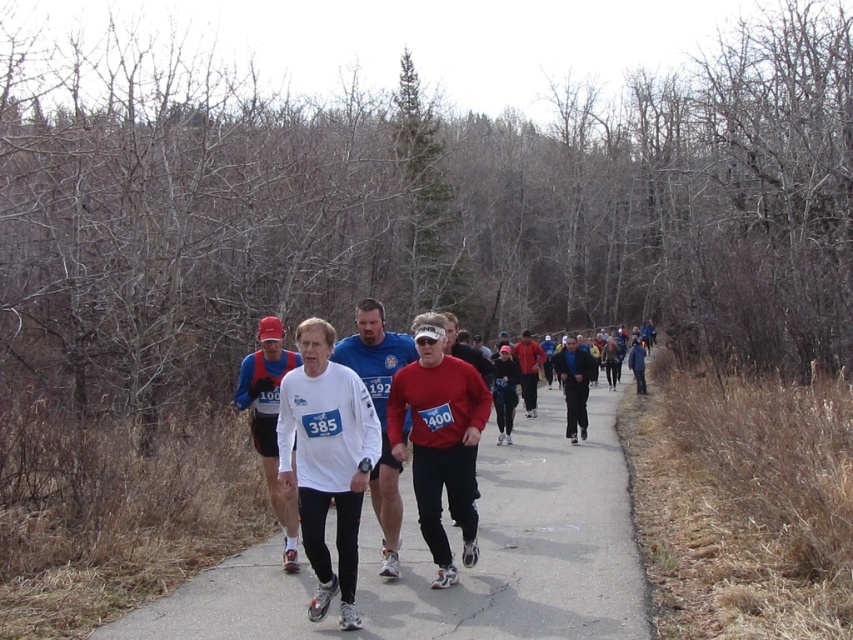
Question: Which object is farther from the camera taking this photo?

Choices:
 (A) matte red shirt at center
 (B) white matte long-sleeve shirt at center
 (C) matte red long-sleeve shirt at center
 (D) gray asphalt road at center

Answer: (A)

Question: Which object is farther from the camera taking this photo?

Choices:
 (A) matte red shirt at center
 (B) gray asphalt road at center
 (C) matte red long-sleeve shirt at center

Answer: (A)

Question: Which of these objects is positioned farthest from the gray asphalt road at center?

Choices:
 (A) matte red shirt at center
 (B) matte red long-sleeve shirt at center
 (C) white matte shirt at center
 (D) white matte long-sleeve shirt at center

Answer: (C)

Question: Can you confirm if gray asphalt road at center is bigger than white matte long-sleeve shirt at center?

Choices:
 (A) no
 (B) yes

Answer: (B)

Question: Considering the relative positions of white matte long-sleeve shirt at center and white matte shirt at center in the image provided, where is white matte long-sleeve shirt at center located with respect to white matte shirt at center?

Choices:
 (A) above
 (B) below

Answer: (A)

Question: Is white matte long-sleeve shirt at center positioned behind white matte shirt at center?

Choices:
 (A) no
 (B) yes

Answer: (A)